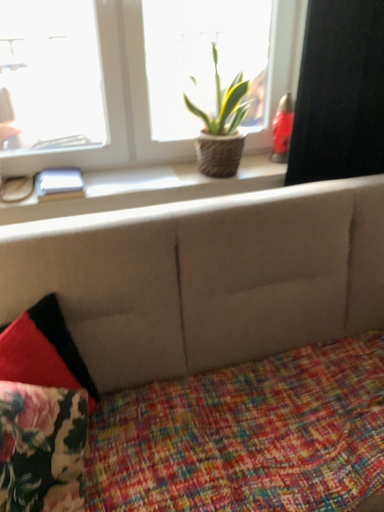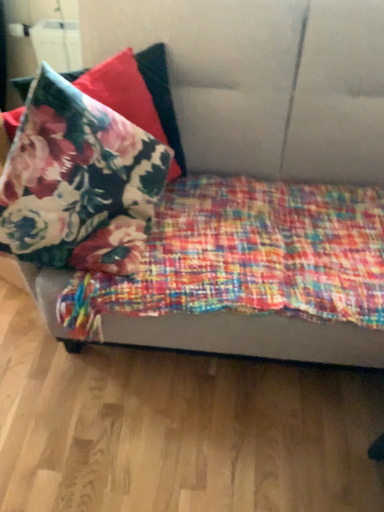
Question: Which way did the camera rotate in the video?

Choices:
 (A) rotated right
 (B) rotated left

Answer: (B)